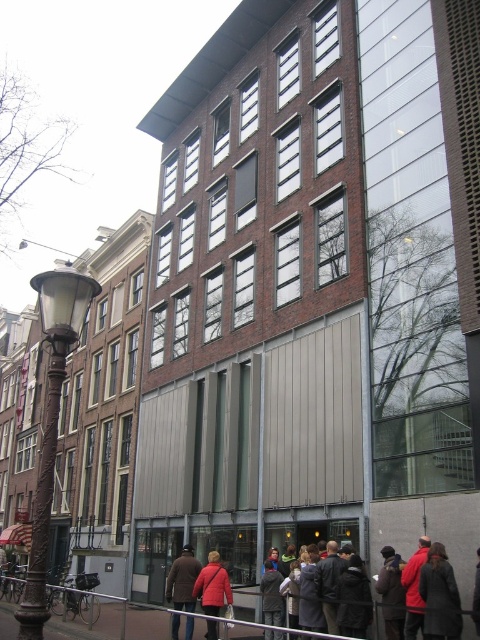
Measure the distance between point (54, 300) and camera.

A distance of 22.90 meters exists between point (54, 300) and camera.

Which is behind, point (41, 628) or point (176, 605)?

The point (176, 605) is behind.

Is point (46, 541) more distant than point (169, 589)?

No.

The image size is (480, 640). In order to click on bronze wrought iron streetlamp at left in this screenshot , I will do `click(50, 422)`.

Can you confirm if bronze wrought iron streetlamp at left is bigger than red jacket at center?

Indeed, bronze wrought iron streetlamp at left has a larger size compared to red jacket at center.

Image resolution: width=480 pixels, height=640 pixels. I want to click on bronze wrought iron streetlamp at left, so click(50, 422).

Who is more distant from viewer, (50,493) or (428,582)?

Point (428,582)

Locate an element on the screen. bronze wrought iron streetlamp at left is located at coordinates (50, 422).

Image resolution: width=480 pixels, height=640 pixels. What do you see at coordinates (440, 595) in the screenshot?
I see `dark gray coat at lower right` at bounding box center [440, 595].

Does dark gray coat at lower right have a lesser width compared to brown leather jacket at lower center?

Correct, dark gray coat at lower right's width is less than brown leather jacket at lower center's.

This screenshot has width=480, height=640. What do you see at coordinates (440, 595) in the screenshot?
I see `dark gray coat at lower right` at bounding box center [440, 595].

Identify the location of dark gray coat at lower right. The height and width of the screenshot is (640, 480). (440, 595).